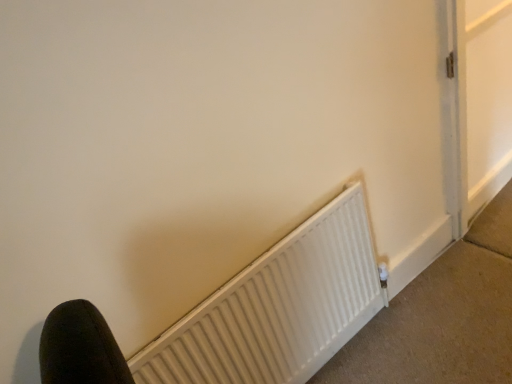
Question: Should I look upward or downward to see white matte radiator at lower center?

Choices:
 (A) down
 (B) up

Answer: (A)

Question: Does white matte radiator at lower center have a greater height compared to white matte radiator at lower center?

Choices:
 (A) no
 (B) yes

Answer: (A)

Question: From a real-world perspective, is white matte radiator at lower center under white matte radiator at lower center?

Choices:
 (A) yes
 (B) no

Answer: (A)

Question: Is white matte radiator at lower center located outside white matte radiator at lower center?

Choices:
 (A) yes
 (B) no

Answer: (A)

Question: Would you say white matte radiator at lower center contains white matte radiator at lower center?

Choices:
 (A) yes
 (B) no

Answer: (B)

Question: From a real-world perspective, is white matte radiator at lower center over white matte radiator at lower center?

Choices:
 (A) yes
 (B) no

Answer: (B)

Question: Considering the relative sizes of white matte radiator at lower center and white matte radiator at lower center in the image provided, is white matte radiator at lower center bigger than white matte radiator at lower center?

Choices:
 (A) yes
 (B) no

Answer: (B)

Question: Is white matte radiator at lower center wider than white matte radiator at lower center?

Choices:
 (A) no
 (B) yes

Answer: (A)

Question: Is white matte radiator at lower center turned away from white matte radiator at lower center?

Choices:
 (A) no
 (B) yes

Answer: (A)

Question: From a real-world perspective, is white matte radiator at lower center on white matte radiator at lower center?

Choices:
 (A) yes
 (B) no

Answer: (A)

Question: From a real-world perspective, is white matte radiator at lower center below white matte radiator at lower center?

Choices:
 (A) no
 (B) yes

Answer: (A)

Question: Considering the relative positions of white matte radiator at lower center and white matte radiator at lower center in the image provided, is white matte radiator at lower center in front of white matte radiator at lower center?

Choices:
 (A) no
 (B) yes

Answer: (B)

Question: Does white matte radiator at lower center appear on the left side of white matte radiator at lower center?

Choices:
 (A) yes
 (B) no

Answer: (A)

Question: In the image, is white matte radiator at lower center positioned in front of or behind white matte radiator at lower center?

Choices:
 (A) front
 (B) behind

Answer: (A)